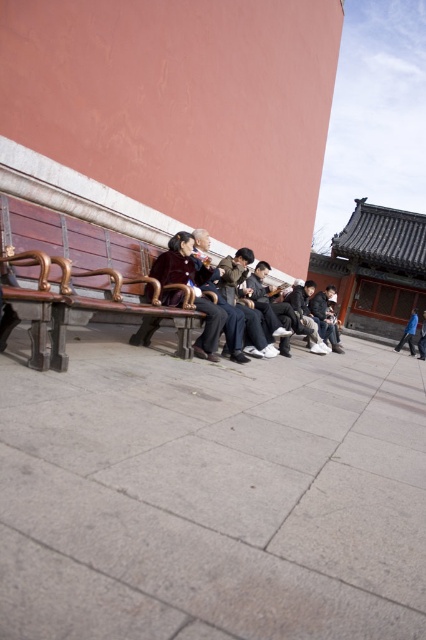
Is dark brown leather jacket at center to the left of velvet-like brown coat at center from the viewer's perspective?

Incorrect, dark brown leather jacket at center is not on the left side of velvet-like brown coat at center.

Is dark brown leather jacket at center smaller than velvet-like brown coat at center?

Incorrect, dark brown leather jacket at center is not smaller in size than velvet-like brown coat at center.

Find the location of a particular element. dark brown leather jacket at center is located at coordinates pyautogui.click(x=204, y=291).

Which is below, blue denim jeans at lower right or dark blue jacket at center?

Positioned lower is blue denim jeans at lower right.

Identify the location of blue denim jeans at lower right. (408, 333).

This screenshot has height=640, width=426. I want to click on blue denim jeans at lower right, so click(x=408, y=333).

Does point (233, 346) come farther from viewer compared to point (422, 353)?

No.

Locate an element on the screen. dark brown leather jacket at center is located at coordinates (204, 291).